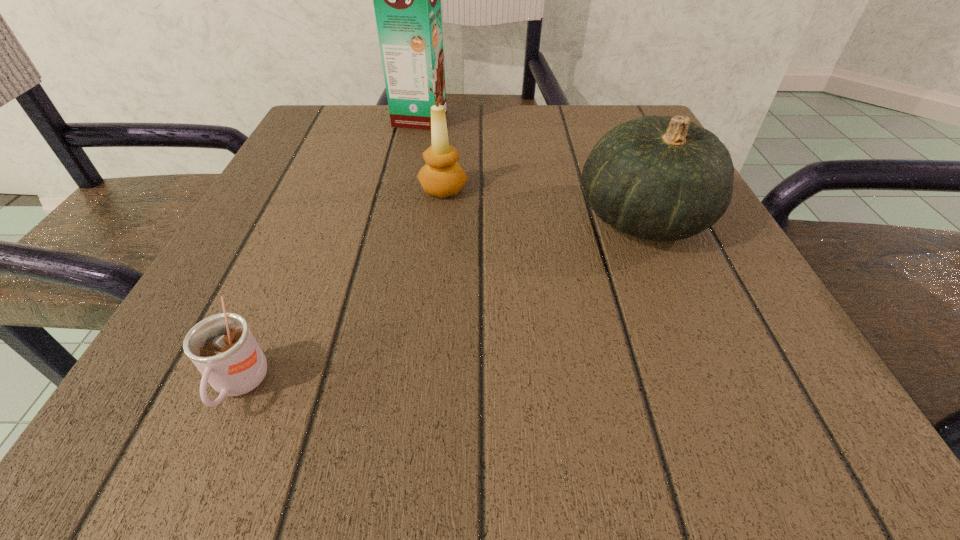
Identify the location of carton. (407, 0).

I want to click on the farthest object, so click(x=407, y=0).

Identify the location of gourd. (661, 178).

This screenshot has height=540, width=960. I want to click on candle_holder, so click(442, 176).

Image resolution: width=960 pixels, height=540 pixels. I want to click on cup, so click(222, 347).

Find the location of a particular element. the nearest object is located at coordinates (222, 347).

Identify the location of vacant space located on the right of the farthest object. The height and width of the screenshot is (540, 960). (624, 118).

Find the location of a particular element. This screenshot has width=960, height=540. vacant region located on the back of the rightmost object is located at coordinates coord(615,152).

Where is `free space located on the back of the candle_holder`? This screenshot has width=960, height=540. free space located on the back of the candle_holder is located at coordinates (451, 111).

The image size is (960, 540). In order to click on object at the far edge in this screenshot , I will do [x=407, y=0].